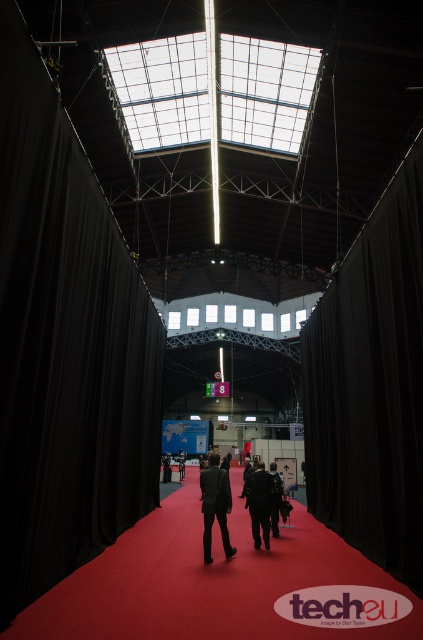
Which of these two, dark suit at center or dark gray suit at center, stands shorter?

dark suit at center is shorter.

Can you confirm if dark suit at center is positioned to the right of dark gray suit at center?

No, dark suit at center is not to the right of dark gray suit at center.

Describe the element at coordinates (216, 506) in the screenshot. I see `dark suit at center` at that location.

Find the location of `dark suit at center`. dark suit at center is located at coordinates click(216, 506).

Which of these two, dark suit at center or black matte suit at center, stands shorter?

dark suit at center is shorter.

Is dark suit at center bigger than black matte suit at center?

No.

Identify the location of dark suit at center. (216, 506).

Does black fabric curtain at right have a smaller size compared to dark gray suit at center?

Indeed, black fabric curtain at right has a smaller size compared to dark gray suit at center.

Between black fabric curtain at right and dark gray suit at center, which one has more height?

black fabric curtain at right is taller.

Identify the location of black fabric curtain at right. Image resolution: width=423 pixels, height=640 pixels. (370, 385).